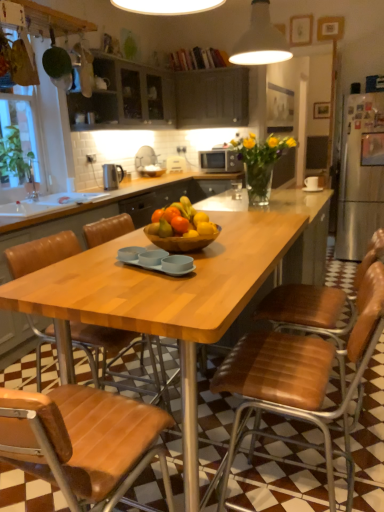
Question: In which direction should I rotate to look at brown leather chair at center, marked as the 2th chair in a left-to-right arrangement?

Choices:
 (A) left
 (B) right

Answer: (B)

Question: Is matte silver microwave at center at the back of polished stainless steel kettle at upper left?

Choices:
 (A) no
 (B) yes

Answer: (A)

Question: Does polished stainless steel kettle at upper left lie in front of matte silver microwave at center?

Choices:
 (A) yes
 (B) no

Answer: (A)

Question: From the image's perspective, is polished stainless steel kettle at upper left under matte silver microwave at center?

Choices:
 (A) yes
 (B) no

Answer: (A)

Question: From a real-world perspective, is polished stainless steel kettle at upper left beneath matte silver microwave at center?

Choices:
 (A) no
 (B) yes

Answer: (B)

Question: Is polished stainless steel kettle at upper left completely or partially outside of matte silver microwave at center?

Choices:
 (A) yes
 (B) no

Answer: (A)

Question: From a real-world perspective, is polished stainless steel kettle at upper left physically above matte silver microwave at center?

Choices:
 (A) yes
 (B) no

Answer: (B)

Question: Is polished stainless steel kettle at upper left taller than matte dark wood cabinets at upper center, the first cabinetry viewed from the right?

Choices:
 (A) no
 (B) yes

Answer: (A)

Question: Is polished stainless steel kettle at upper left facing towards matte dark wood cabinets at upper center, the first cabinetry viewed from the right?

Choices:
 (A) no
 (B) yes

Answer: (A)

Question: Is polished stainless steel kettle at upper left far from matte dark wood cabinets at upper center, the first cabinetry viewed from the right?

Choices:
 (A) no
 (B) yes

Answer: (B)

Question: Is polished stainless steel kettle at upper left bigger than matte dark wood cabinets at upper center, marked as the 2th cabinetry in a left-to-right arrangement?

Choices:
 (A) no
 (B) yes

Answer: (A)

Question: Could matte dark wood cabinets at upper center, the first cabinetry viewed from the right, be considered to be inside polished stainless steel kettle at upper left?

Choices:
 (A) yes
 (B) no

Answer: (B)

Question: Considering the relative sizes of polished stainless steel kettle at upper left and matte dark wood cabinets at upper center, marked as the 2th cabinetry in a left-to-right arrangement, in the image provided, is polished stainless steel kettle at upper left smaller than matte dark wood cabinets at upper center, marked as the 2th cabinetry in a left-to-right arrangement,?

Choices:
 (A) yes
 (B) no

Answer: (A)

Question: Is matte dark wood cabinets at upper center, marked as the 2th cabinetry in a left-to-right arrangement, directly adjacent to brown leather chair at lower left, the second chair from the right?

Choices:
 (A) no
 (B) yes

Answer: (A)